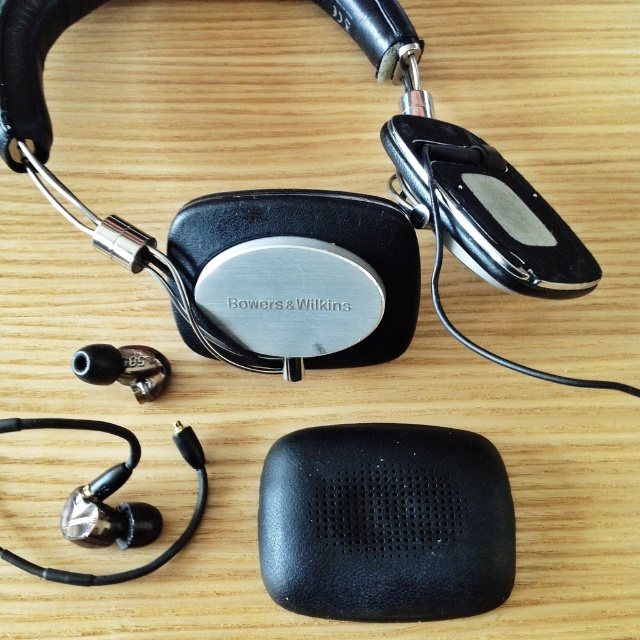
How distant is black matte speaker at center from metallic silver earphone at lower left?

14.13 inches

Is black matte speaker at center wider than metallic silver earphone at lower left?

Yes.

Where is `black matte speaker at center`? Image resolution: width=640 pixels, height=640 pixels. black matte speaker at center is located at coordinates (385, 522).